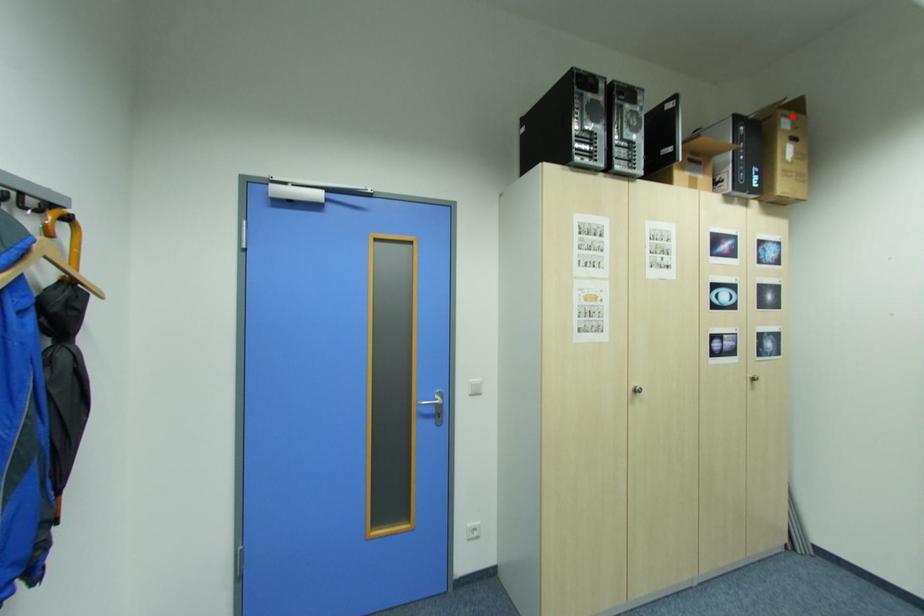
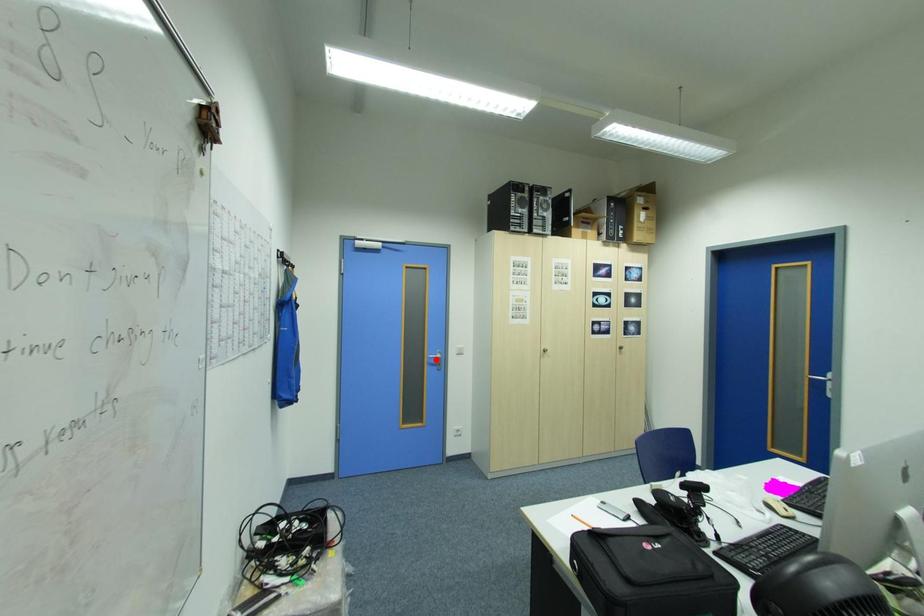
I am providing you with two images of the same scene from different viewpoints. A red point is marked on the first image and another point is marked on the second image. Are the points marked in image1 and image2 representing the same 3D position?

No